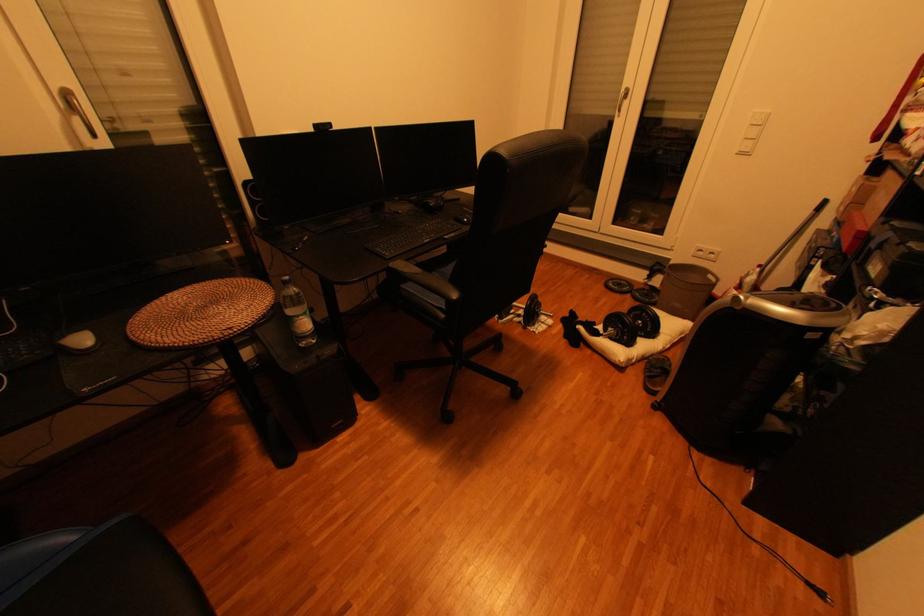
The image size is (924, 616). Describe the element at coordinates (415, 272) in the screenshot. I see `the chair armrest` at that location.